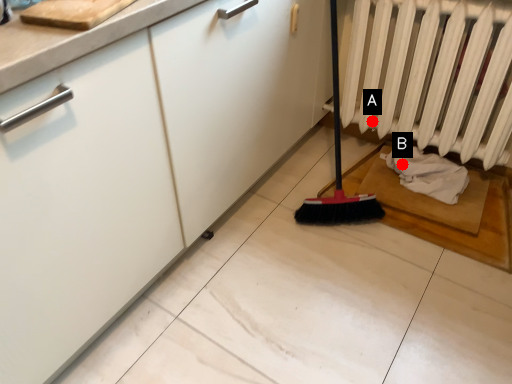
Question: Two points are circled on the image, labeled by A and B beside each circle. Which point appears closest to the camera in this image?

Choices:
 (A) A is closer
 (B) B is closer

Answer: (B)